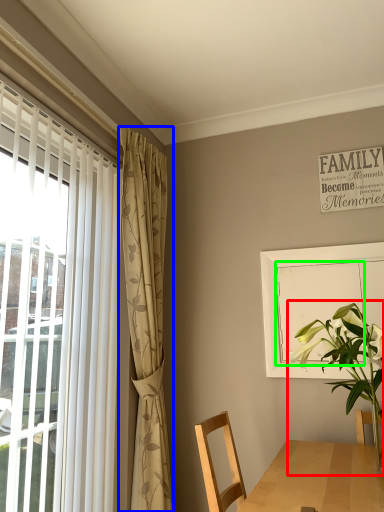
Question: Which object is the farthest from houseplant (highlighted by a red box)? Choose among these: curtain (highlighted by a blue box) or screen door (highlighted by a green box).

Choices:
 (A) curtain
 (B) screen door

Answer: (A)